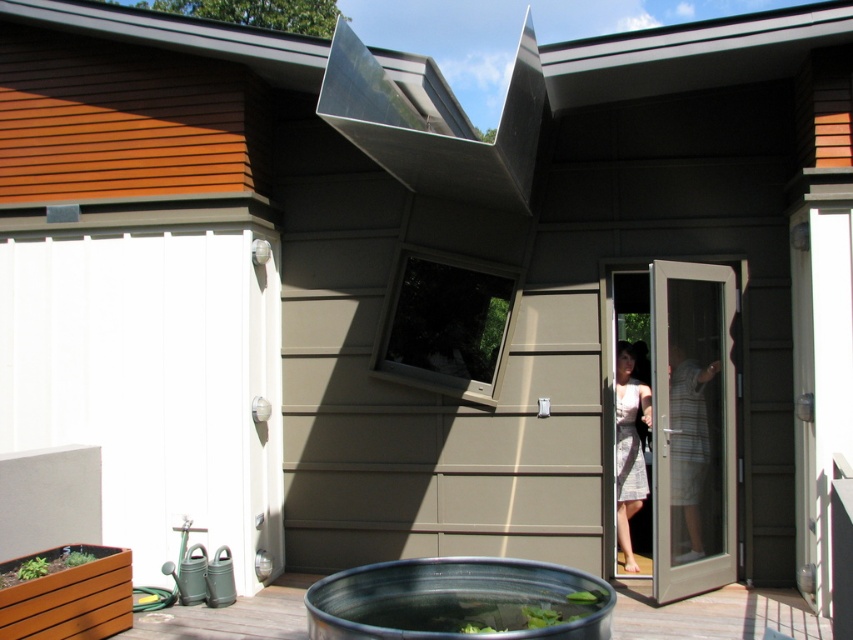
Question: In this image, where is smooth wooden deck at lower left located relative to striped cotton shirt at door?

Choices:
 (A) above
 (B) below

Answer: (B)

Question: Which object is the closest to the patterned fabric dress at door?

Choices:
 (A) metallic silver exhaust hood at upper center
 (B) smooth wooden deck at lower left

Answer: (B)

Question: Which of the following is the farthest from the observer?

Choices:
 (A) metallic silver exhaust hood at upper center
 (B) patterned fabric dress at door

Answer: (B)

Question: Is metallic silver exhaust hood at upper center thinner than striped cotton shirt at door?

Choices:
 (A) no
 (B) yes

Answer: (A)

Question: Can you confirm if metallic silver tub at lower center is positioned to the right of patterned fabric dress at door?

Choices:
 (A) no
 (B) yes

Answer: (A)

Question: Which point is closer to the camera taking this photo?

Choices:
 (A) (634, 451)
 (B) (583, 612)

Answer: (B)